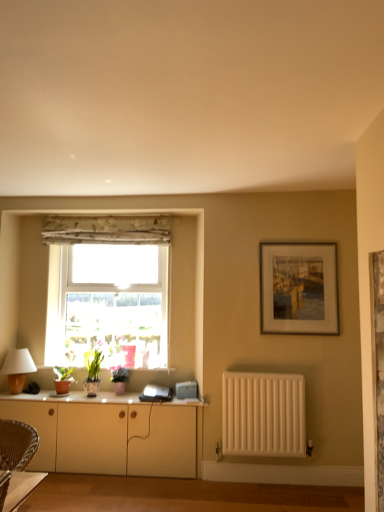
Question: Is white matte radiator at lower right at the right side of floral fabric curtain at upper center?

Choices:
 (A) no
 (B) yes

Answer: (B)

Question: Is floral fabric curtain at upper center at the back of white matte radiator at lower right?

Choices:
 (A) yes
 (B) no

Answer: (B)

Question: Is white matte radiator at lower right far from floral fabric curtain at upper center?

Choices:
 (A) yes
 (B) no

Answer: (A)

Question: From the image's perspective, is white matte radiator at lower right beneath floral fabric curtain at upper center?

Choices:
 (A) no
 (B) yes

Answer: (B)

Question: Is white matte radiator at lower right smaller than floral fabric curtain at upper center?

Choices:
 (A) yes
 (B) no

Answer: (B)

Question: Is satin white laptop at center wider or thinner than white matte cabinet at lower center?

Choices:
 (A) wide
 (B) thin

Answer: (B)

Question: From the image's perspective, relative to white matte cabinet at lower center, is satin white laptop at center above or below?

Choices:
 (A) above
 (B) below

Answer: (A)

Question: From a real-world perspective, relative to white matte cabinet at lower center, is satin white laptop at center vertically above or below?

Choices:
 (A) above
 (B) below

Answer: (A)

Question: Does point (193, 385) appear closer or farther from the camera than point (109, 411)?

Choices:
 (A) farther
 (B) closer

Answer: (A)

Question: From a real-world perspective, is transparent glass window at center physically located above or below white glossy cabinet at lower center?

Choices:
 (A) below
 (B) above

Answer: (B)

Question: In the image, is transparent glass window at center on the left side or the right side of white glossy cabinet at lower center?

Choices:
 (A) left
 (B) right

Answer: (B)

Question: Is point (157, 367) closer or farther from the camera than point (39, 394)?

Choices:
 (A) closer
 (B) farther

Answer: (B)

Question: Is transparent glass window at center inside the boundaries of white glossy cabinet at lower center, or outside?

Choices:
 (A) outside
 (B) inside

Answer: (A)

Question: Is floral fabric curtain at upper center in front of or behind transparent glass window at center in the image?

Choices:
 (A) front
 (B) behind

Answer: (B)

Question: From their relative heights in the image, would you say floral fabric curtain at upper center is taller or shorter than transparent glass window at center?

Choices:
 (A) short
 (B) tall

Answer: (A)